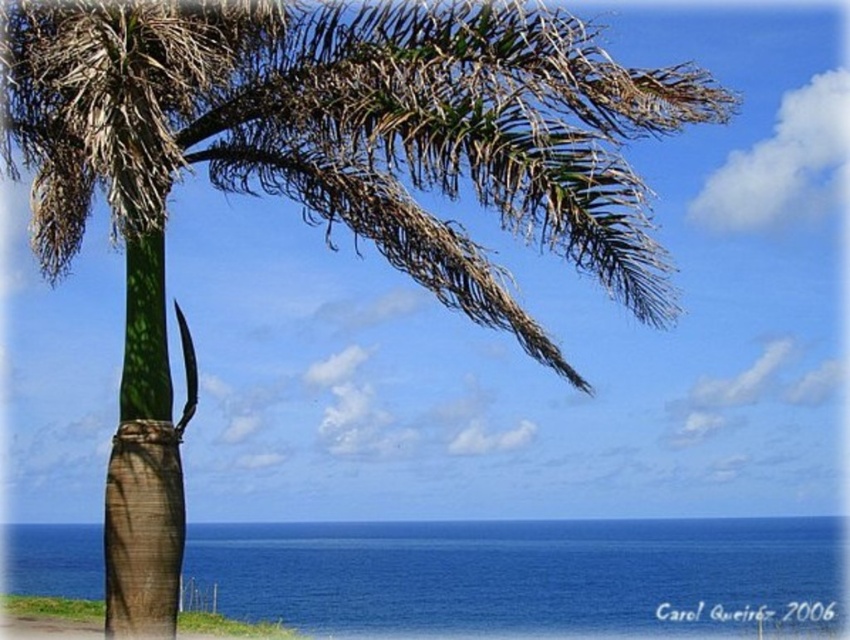
Question: Is blue liquid water at lower center below smooth sand at lower left?

Choices:
 (A) no
 (B) yes

Answer: (A)

Question: From the image, what is the correct spatial relationship of blue liquid water at lower center in relation to smooth sand at lower left?

Choices:
 (A) above
 (B) below

Answer: (A)

Question: Which point is farther to the camera?

Choices:
 (A) (54, 612)
 (B) (489, 561)

Answer: (B)

Question: Does blue liquid water at lower center come behind smooth sand at lower left?

Choices:
 (A) yes
 (B) no

Answer: (A)

Question: Which of the following is the closest to the observer?

Choices:
 (A) (227, 628)
 (B) (690, 545)

Answer: (A)

Question: Which point appears farthest from the camera in this image?

Choices:
 (A) (191, 620)
 (B) (816, 602)

Answer: (B)